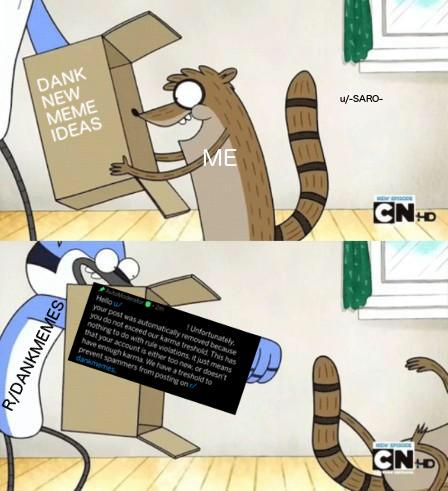
Identify the location of cardboard box. Image resolution: width=448 pixels, height=491 pixels. (71, 152), (91, 387).